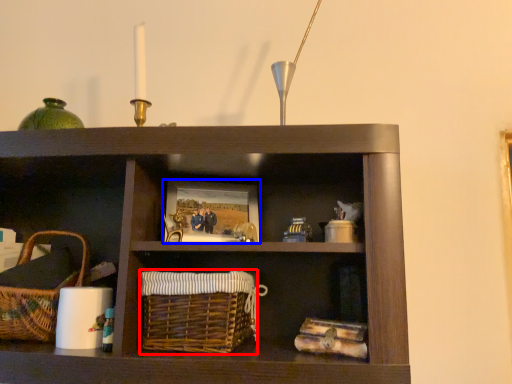
Question: Which object is closer to the camera taking this photo, basket (highlighted by a red box) or picture frame (highlighted by a blue box)?

Choices:
 (A) basket
 (B) picture frame

Answer: (A)